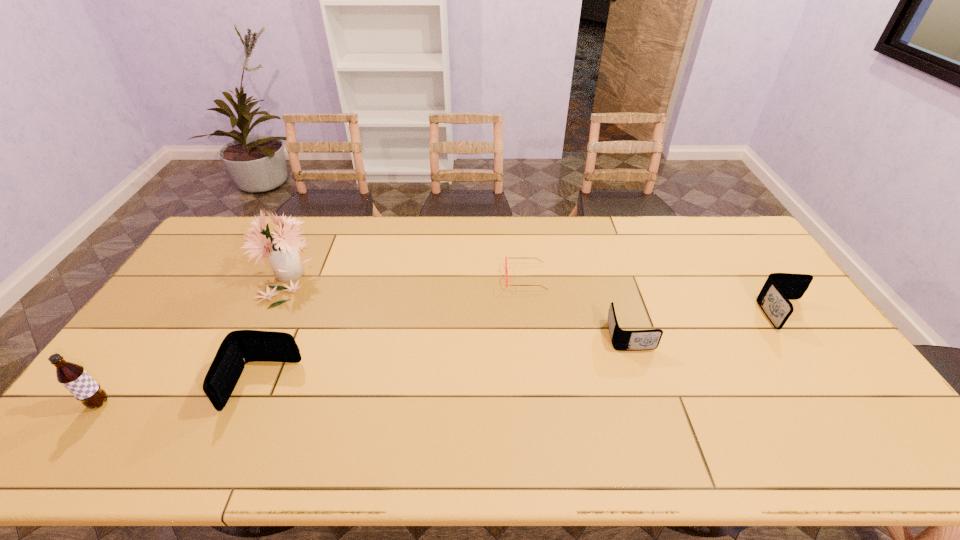
Locate an element on the screen. The width and height of the screenshot is (960, 540). free space located 0.380m on the outer surface of the shortest wallet is located at coordinates (782, 336).

This screenshot has height=540, width=960. I want to click on vacant space located 0.210m on the outer surface of the rightmost object, so click(x=844, y=396).

Identify the location of vacant space located on the left of the tallest object. The image size is (960, 540). (189, 273).

Locate an element on the screen. The height and width of the screenshot is (540, 960). vacant region located on the front-facing side of the spectacles is located at coordinates (458, 278).

Locate an element on the screen. Image resolution: width=960 pixels, height=540 pixels. free location located on the front-facing side of the spectacles is located at coordinates (419, 278).

Where is `free space located 0.160m on the front-facing side of the spectacles`? The width and height of the screenshot is (960, 540). free space located 0.160m on the front-facing side of the spectacles is located at coordinates (458, 278).

Find the location of a particular element. The image size is (960, 540). free location located on the right of the leftmost object is located at coordinates (173, 403).

Image resolution: width=960 pixels, height=540 pixels. In order to click on object situated at the far edge in this screenshot , I will do `click(282, 250)`.

The width and height of the screenshot is (960, 540). Find the location of `wallet that is at the near edge`. wallet that is at the near edge is located at coordinates (239, 347).

The height and width of the screenshot is (540, 960). Find the location of `root beer that is at the near edge`. root beer that is at the near edge is located at coordinates (73, 377).